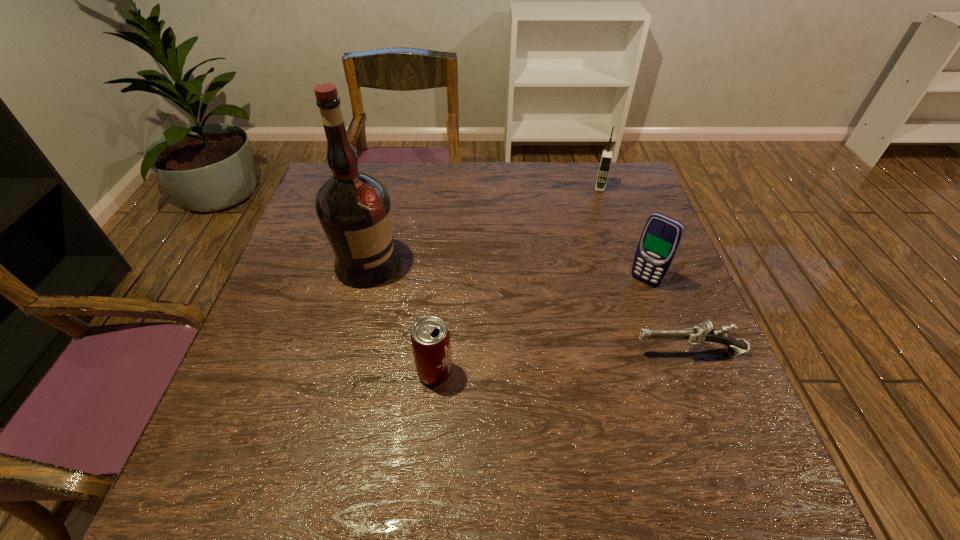
Locate an element on the screen. The height and width of the screenshot is (540, 960). the fourth object from right to left is located at coordinates (430, 338).

Image resolution: width=960 pixels, height=540 pixels. I want to click on the second shortest object, so point(430,338).

You are a GUI agent. You are given a task and a screenshot of the screen. Output one action in this format:
    pyautogui.click(x=<x>, y=<y>)
    Task: Click on the shortest object
    The height and width of the screenshot is (540, 960).
    Given the screenshot: What is the action you would take?
    pyautogui.click(x=703, y=335)

The image size is (960, 540). What are the coordinates of `the nearer cellular telephone` in the screenshot? It's located at [661, 237].

Locate an element on the screen. This screenshot has width=960, height=540. the tallest object is located at coordinates (354, 208).

At what (x,y) coordinates should I click in order to perform the action: click on the leftmost object. Please return your answer as a coordinate pair (x, y). The height and width of the screenshot is (540, 960). Looking at the image, I should click on (354, 208).

The width and height of the screenshot is (960, 540). Find the location of `the farthest object`. the farthest object is located at coordinates coord(606,158).

Where is `vacant region located on the back of the second object from left to right`? Image resolution: width=960 pixels, height=540 pixels. vacant region located on the back of the second object from left to right is located at coordinates (444, 266).

Image resolution: width=960 pixels, height=540 pixels. Identify the location of free region located 0.080m aimed along the barrel of the gun. click(x=595, y=353).

Identify the location of vacant space located 0.110m aimed along the barrel of the gun. This screenshot has height=540, width=960. (581, 353).